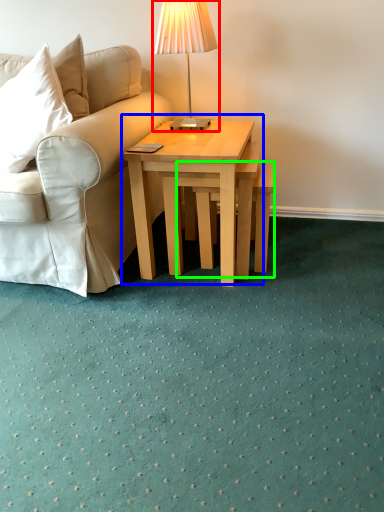
Question: Based on their relative distances, which object is nearer to table lamp (highlighted by a red box)? Choose from coffee table (highlighted by a blue box) and stool (highlighted by a green box).

Choices:
 (A) coffee table
 (B) stool

Answer: (A)